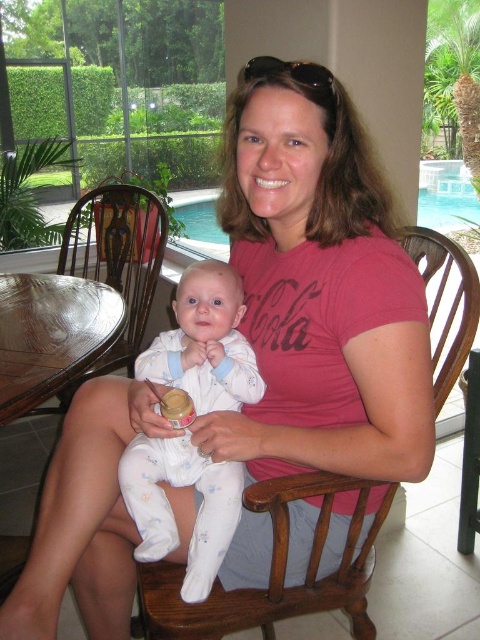
Question: Is white cotton onesie at center behind wooden rocking chair at center?

Choices:
 (A) no
 (B) yes

Answer: (B)

Question: Can you confirm if white cotton onesie at center is wider than wooden rocking chair at center?

Choices:
 (A) yes
 (B) no

Answer: (B)

Question: Does white cotton onesie at center have a lesser width compared to wooden rocking chair at center?

Choices:
 (A) no
 (B) yes

Answer: (B)

Question: Which point appears farthest from the camera in this image?

Choices:
 (A) (235, 388)
 (B) (167, 592)

Answer: (B)